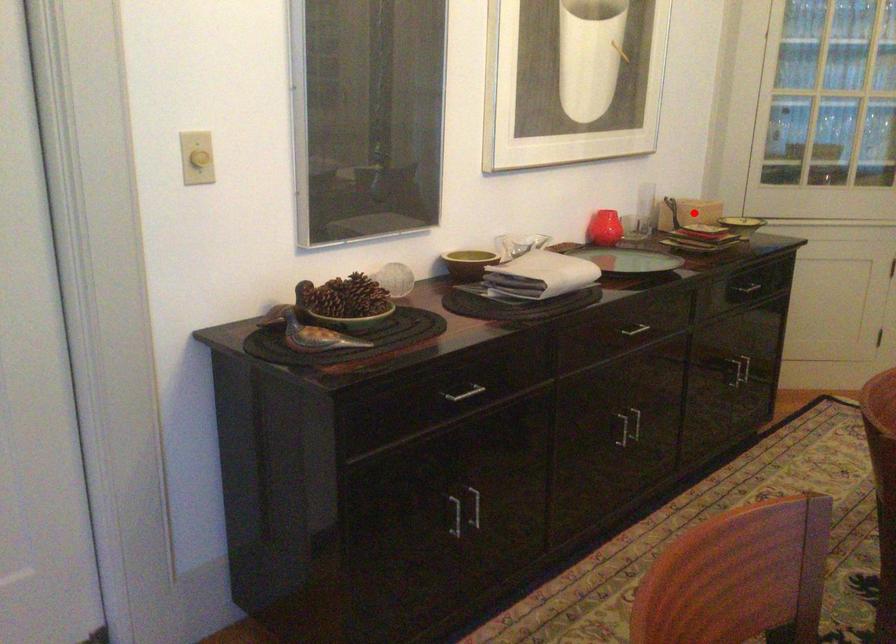
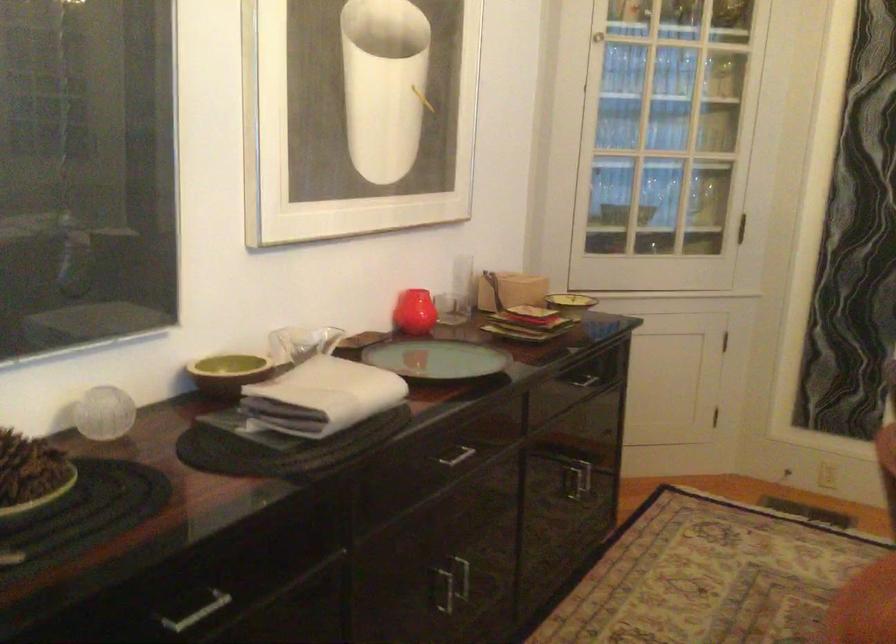
The point at the highlighted location is marked in the first image. Where is the corresponding point in the second image?

(510, 290)